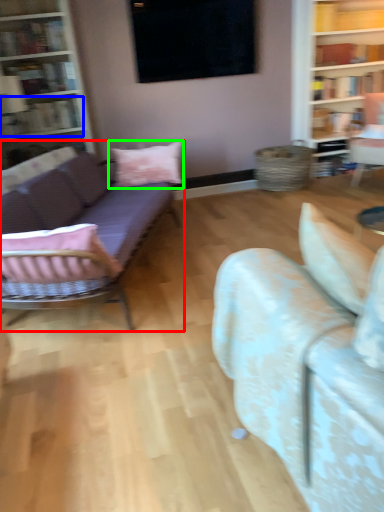
Question: Which object is the closest to the studio couch (highlighted by a red box)? Choose among these: book (highlighted by a blue box) or pillow (highlighted by a green box).

Choices:
 (A) book
 (B) pillow

Answer: (B)